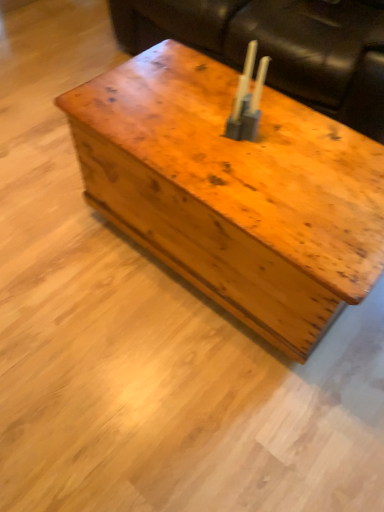
Image resolution: width=384 pixels, height=512 pixels. What do you see at coordinates (279, 46) in the screenshot?
I see `leather couch at upper center` at bounding box center [279, 46].

In order to click on metallic silver candle holder at center in this screenshot , I will do `click(247, 98)`.

Does wooden trunk at center contain metallic silver candle holder at center?

No, wooden trunk at center does not contain metallic silver candle holder at center.

From a real-world perspective, is wooden trunk at center located beneath metallic silver candle holder at center?

Correct, in the physical world, wooden trunk at center is lower than metallic silver candle holder at center.

How different are the orientations of wooden trunk at center and metallic silver candle holder at center in degrees?

The facing directions of wooden trunk at center and metallic silver candle holder at center are 2.98 degrees apart.

Find the location of a particular element. The width and height of the screenshot is (384, 512). table on the left of metallic silver candle holder at center is located at coordinates (234, 191).

Is leather couch at upper center bigger than metallic silver candle holder at center?

Yes, leather couch at upper center is bigger than metallic silver candle holder at center.

Where is `candle holder on the left of leather couch at upper center`? This screenshot has height=512, width=384. candle holder on the left of leather couch at upper center is located at coordinates (247, 98).

Is leather couch at upper center oriented away from metallic silver candle holder at center?

leather couch at upper center is not turned away from metallic silver candle holder at center.

From the image's perspective, which one is positioned higher, leather couch at upper center or metallic silver candle holder at center?

leather couch at upper center appears higher in the image.

Does wooden trunk at center appear on the right side of leather couch at upper center?

Incorrect, wooden trunk at center is not on the right side of leather couch at upper center.

You are a GUI agent. You are given a task and a screenshot of the screen. Output one action in this format:
    pyautogui.click(x=<x>, y=<y>)
    Task: Click on the couch behind the wooden trunk at center
    The height and width of the screenshot is (512, 384).
    Given the screenshot: What is the action you would take?
    [x=279, y=46]

Which is in front, wooden trunk at center or leather couch at upper center?

wooden trunk at center.

Consider the image. Would you say wooden trunk at center is inside or outside leather couch at upper center?

wooden trunk at center lies outside leather couch at upper center.

Would you say metallic silver candle holder at center is outside leather couch at upper center?

Yes.

Between point (238, 122) and point (377, 139), which one is positioned in front?

The point (238, 122) is closer.

Which of these two, metallic silver candle holder at center or leather couch at upper center, is wider?

With larger width is leather couch at upper center.

Between metallic silver candle holder at center and leather couch at upper center, which one has more height?

Standing taller between the two is leather couch at upper center.

From the picture: Considering the sizes of objects metallic silver candle holder at center and wooden trunk at center in the image provided, who is bigger, metallic silver candle holder at center or wooden trunk at center?

wooden trunk at center is bigger.

From the image's perspective, which one is positioned lower, metallic silver candle holder at center or wooden trunk at center?

wooden trunk at center, from the image's perspective.

Is metallic silver candle holder at center shorter than wooden trunk at center?

Indeed, metallic silver candle holder at center has a lesser height compared to wooden trunk at center.

Does metallic silver candle holder at center have a greater width compared to wooden trunk at center?

In fact, metallic silver candle holder at center might be narrower than wooden trunk at center.

Is point (243, 61) closer or farther from the camera than point (224, 147)?

Point (243, 61) is farther from the camera than point (224, 147).

Which of these two, leather couch at upper center or wooden trunk at center, stands shorter?

wooden trunk at center is shorter.

Is the depth of leather couch at upper center greater than that of wooden trunk at center?

Yes.

How distant is leather couch at upper center from wooden trunk at center?

leather couch at upper center and wooden trunk at center are 25.01 inches apart.

Where is `table beneath the metallic silver candle holder at center (from a real-world perspective)`? The image size is (384, 512). table beneath the metallic silver candle holder at center (from a real-world perspective) is located at coordinates (234, 191).

Where is `couch behind the metallic silver candle holder at center`? The height and width of the screenshot is (512, 384). couch behind the metallic silver candle holder at center is located at coordinates (279, 46).

Based on their spatial positions, is wooden trunk at center or leather couch at upper center further from metallic silver candle holder at center?

Based on the image, leather couch at upper center appears to be further to metallic silver candle holder at center.

Which object lies nearer to the anchor point wooden trunk at center, leather couch at upper center or metallic silver candle holder at center?

The object closer to wooden trunk at center is metallic silver candle holder at center.

Based on their spatial positions, is metallic silver candle holder at center or wooden trunk at center closer to leather couch at upper center?

wooden trunk at center is closer to leather couch at upper center.

Looking at the image, which one is located closer to leather couch at upper center, wooden trunk at center or metallic silver candle holder at center?

wooden trunk at center.

Looking at the image, which one is located further to metallic silver candle holder at center, leather couch at upper center or wooden trunk at center?

Based on the image, leather couch at upper center appears to be further to metallic silver candle holder at center.

Looking at this image, estimate the real-world distances between objects in this image. Which object is further from wooden trunk at center, metallic silver candle holder at center or leather couch at upper center?

leather couch at upper center lies further to wooden trunk at center than the other object.

Where is `candle holder between leather couch at upper center and wooden trunk at center in the vertical direction`? The image size is (384, 512). candle holder between leather couch at upper center and wooden trunk at center in the vertical direction is located at coordinates (247, 98).